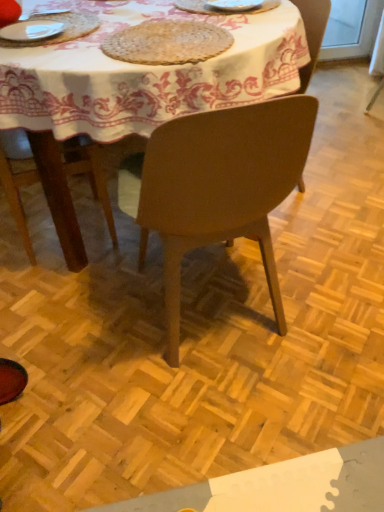
Identify the location of vacant space that's between white glossy plate at upper left and woven natural fiber mat at upper center. The width and height of the screenshot is (384, 512). (82, 47).